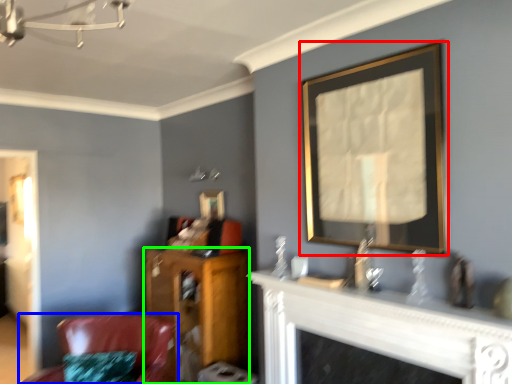
Question: Which object is the closest to the picture frame (highlighted by a red box)? Choose among these: chair (highlighted by a blue box) or furniture (highlighted by a green box).

Choices:
 (A) chair
 (B) furniture

Answer: (B)